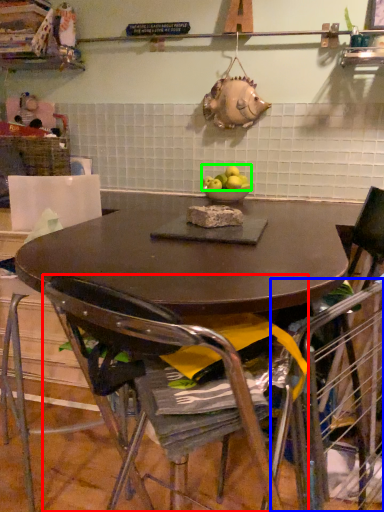
Question: Which is farther away from chair (highlighted by a red box)? armchair (highlighted by a blue box) or apple (highlighted by a green box)?

Choices:
 (A) armchair
 (B) apple

Answer: (B)